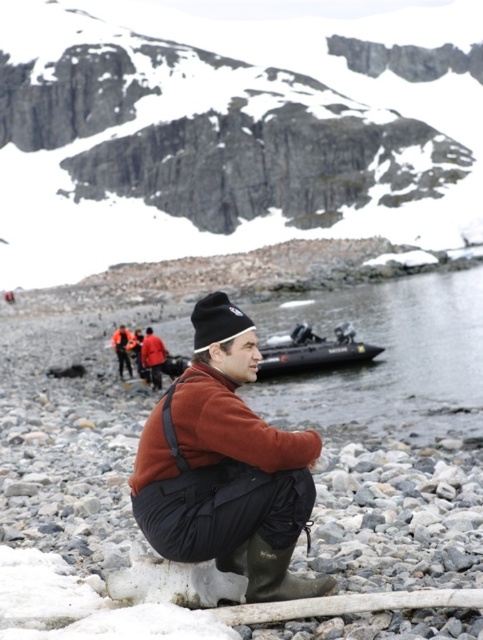
Is white matte snow at upper center closer to camera compared to matte brown jacket at center?

No, it is not.

Consider the image. Which is above, white matte snow at upper center or matte brown jacket at center?

white matte snow at upper center is above.

At what (x,y) coordinates should I click in order to perform the action: click on white matte snow at upper center. Please return your answer as a coordinate pair (x, y). This screenshot has height=640, width=483. Looking at the image, I should click on (230, 132).

From the picture: Is the position of matte brown jacket at center less distant than that of rubber inflatable boat at center?

Yes, it is.

Based on the photo, does matte brown jacket at center appear over rubber inflatable boat at center?

Actually, matte brown jacket at center is below rubber inflatable boat at center.

At what (x,y) coordinates should I click in order to perform the action: click on matte brown jacket at center. Please return your answer as a coordinate pair (x, y). This screenshot has height=640, width=483. Looking at the image, I should click on (226, 467).

This screenshot has width=483, height=640. Find the location of `matte brown jacket at center`. matte brown jacket at center is located at coordinates (226, 467).

Does white matte snow at upper center come in front of rubber inflatable boat at center?

No.

Identify the location of white matte snow at upper center. (230, 132).